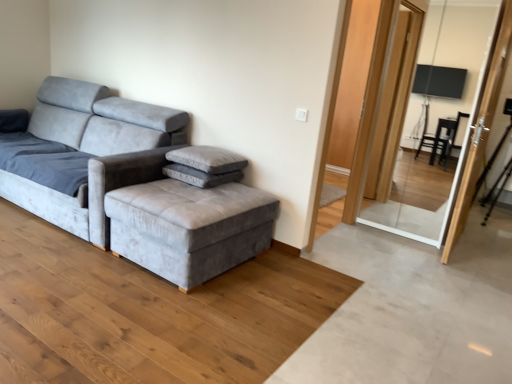
Question: Can you see velvet gray couch at left touching transparent glass screen door at upper right, the second screen door from the right?

Choices:
 (A) yes
 (B) no

Answer: (B)

Question: From a real-world perspective, does velvet gray couch at left sit lower than transparent glass screen door at upper right, the second screen door from the right?

Choices:
 (A) no
 (B) yes

Answer: (B)

Question: Is velvet gray couch at left facing towards transparent glass screen door at upper right, the second screen door from the right?

Choices:
 (A) yes
 (B) no

Answer: (B)

Question: Is velvet gray couch at left positioned far away from transparent glass screen door at upper right, the first screen door when ordered from left to right?

Choices:
 (A) yes
 (B) no

Answer: (A)

Question: Is transparent glass screen door at upper right, the first screen door when ordered from left to right, located within velvet gray couch at left?

Choices:
 (A) no
 (B) yes

Answer: (A)

Question: Is velvet gray couch at left positioned beyond the bounds of transparent glass screen door at upper right, the second screen door from the right?

Choices:
 (A) yes
 (B) no

Answer: (A)

Question: Considering the relative positions of velvet gray couch at left and gray fabric footrest at center in the image provided, is velvet gray couch at left to the left of gray fabric footrest at center from the viewer's perspective?

Choices:
 (A) yes
 (B) no

Answer: (A)

Question: Does velvet gray couch at left touch gray fabric footrest at center?

Choices:
 (A) yes
 (B) no

Answer: (B)

Question: Considering the relative sizes of velvet gray couch at left and gray fabric footrest at center in the image provided, is velvet gray couch at left wider than gray fabric footrest at center?

Choices:
 (A) no
 (B) yes

Answer: (B)

Question: Can you confirm if velvet gray couch at left is bigger than gray fabric footrest at center?

Choices:
 (A) yes
 (B) no

Answer: (A)

Question: Is velvet gray couch at left facing away from gray fabric footrest at center?

Choices:
 (A) yes
 (B) no

Answer: (B)

Question: Considering the relative sizes of velvet gray couch at left and gray fabric footrest at center in the image provided, is velvet gray couch at left shorter than gray fabric footrest at center?

Choices:
 (A) yes
 (B) no

Answer: (B)

Question: Does transparent glass screen door at upper right, the second screen door from the right, appear on the left side of gray velvety pillow at center?

Choices:
 (A) yes
 (B) no

Answer: (B)